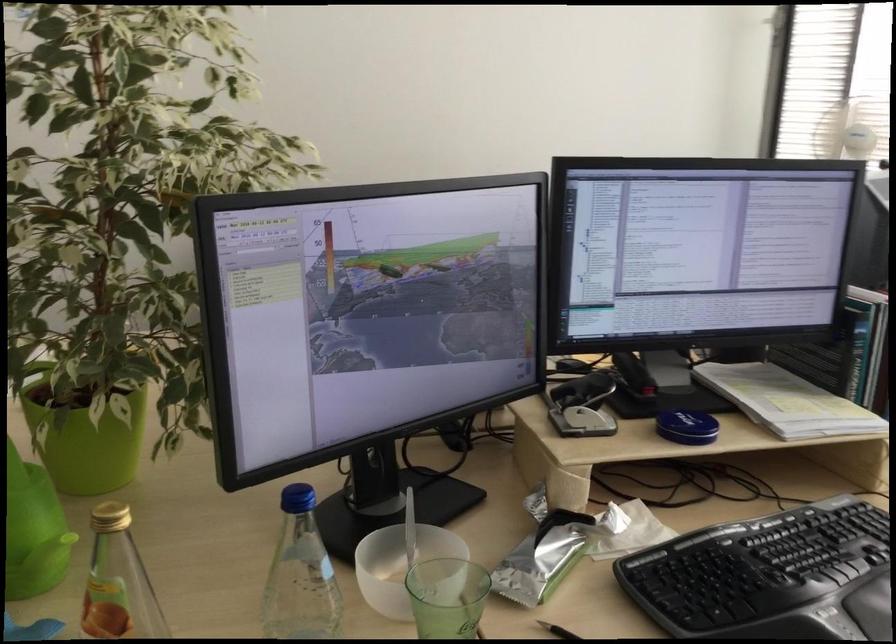
The image size is (896, 644). What do you see at coordinates (297, 498) in the screenshot?
I see `the blue bottle cap` at bounding box center [297, 498].